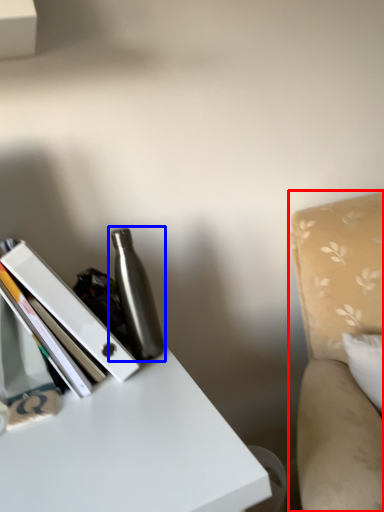
Question: Which point is further to the camera, swivel chair (highlighted by a red box) or bottle (highlighted by a blue box)?

Choices:
 (A) swivel chair
 (B) bottle

Answer: (B)